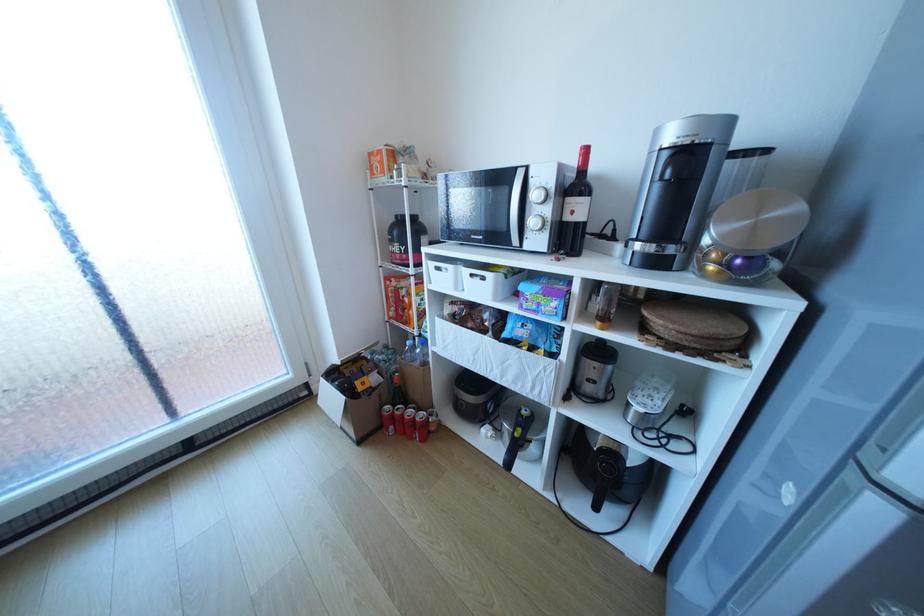
Find where to grasp the black pot handle. Please return your answer as a coordinate pair (x, y).

(599, 491)